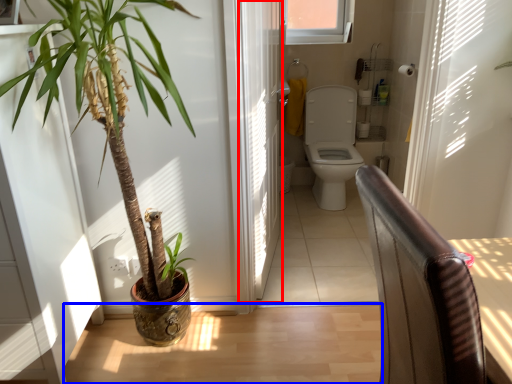
Question: Which object appears farthest to the camera in this image, screen door (highlighted by a red box) or path (highlighted by a blue box)?

Choices:
 (A) screen door
 (B) path

Answer: (B)